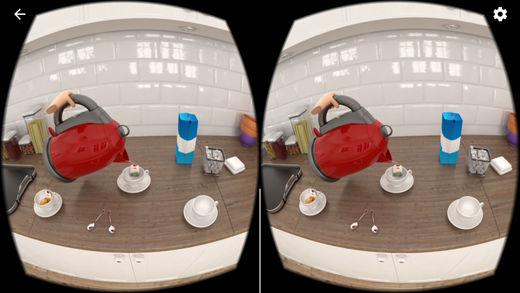
You are a GUI agent. You are given a task and a screenshot of the screen. Output one action in this format:
    pyautogui.click(x=<x>, y=<y>)
    Task: Click on the cups
    The width and height of the screenshot is (520, 293).
    Given the screenshot: What is the action you would take?
    pyautogui.click(x=200, y=201), pyautogui.click(x=311, y=193), pyautogui.click(x=391, y=175), pyautogui.click(x=462, y=210), pyautogui.click(x=139, y=173), pyautogui.click(x=50, y=197)